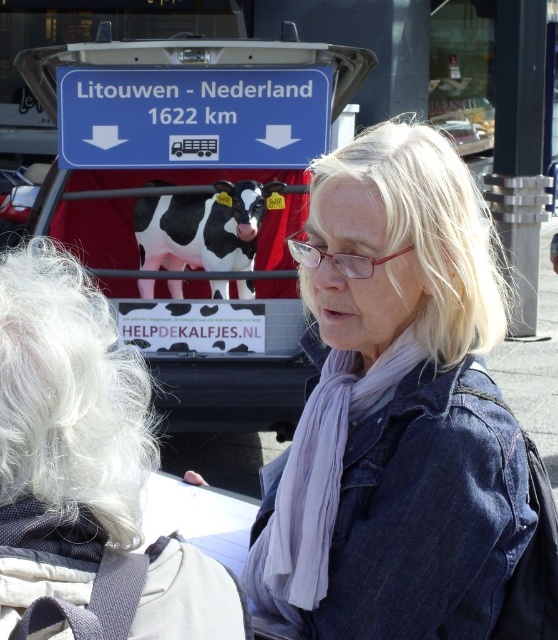
Can you confirm if denim jacket at center is smaller than metallic blue sign at center?

Yes.

In the scene shown: Between denim jacket at center and metallic blue sign at center, which one has more height?

Standing taller between the two is denim jacket at center.

This screenshot has height=640, width=558. Find the location of `denim jacket at center`. denim jacket at center is located at coordinates (395, 408).

You are a GUI agent. You are given a task and a screenshot of the screen. Output one action in this format:
    pyautogui.click(x=<x>, y=<y>)
    Task: Click on the denim jacket at center
    The height and width of the screenshot is (640, 558).
    Given the screenshot: What is the action you would take?
    pyautogui.click(x=395, y=408)

Who is more distant from viewer, (x=446, y=230) or (x=94, y=106)?

Point (x=94, y=106)

Can you confirm if denim jacket at center is bigger than blue plastic sign at upper center?

Indeed, denim jacket at center has a larger size compared to blue plastic sign at upper center.

Is point (459, 218) positioned before point (310, 147)?

Yes, point (459, 218) is closer to viewer.

You are a GUI agent. You are given a task and a screenshot of the screen. Output one action in this format:
    pyautogui.click(x=<x>, y=<y>)
    Task: Click on the denim jacket at center
    This screenshot has height=640, width=558.
    Given the screenshot: What is the action you would take?
    [x=395, y=408]

Who is positioned more to the left, metallic blue sign at center or blue plastic sign at upper center?

From the viewer's perspective, blue plastic sign at upper center appears more on the left side.

Is point (201, 48) farther from camera compared to point (321, 92)?

No, it is not.

Identify the location of metallic blue sign at center. The image size is (558, 640). (195, 189).